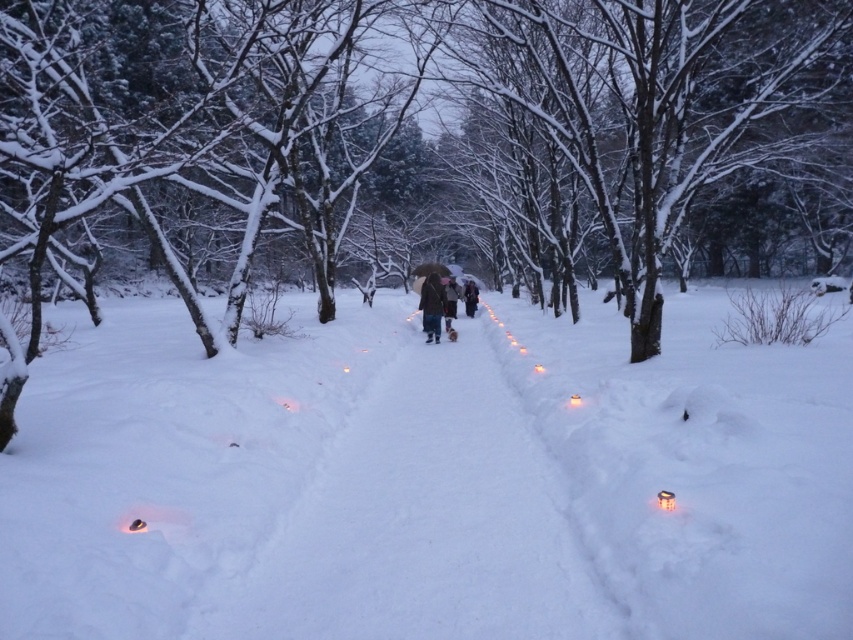
You are standing at the camera position in the snowy forest scene. There are two points marked on the path ahead of you. The first point is at coordinates point (430, 291) and the second is at point (447, 296). Which point is closer to your current position?

Point (430, 291) is closer to the camera than point (447, 296).